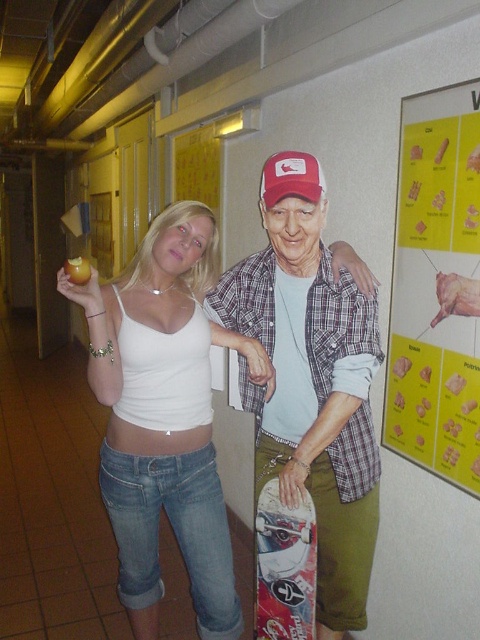
You are standing in the hallway and want to reach the point at coordinates point (x=405, y=276). If you can move forward 6 feet, will you be able to reach it?

The point (x=405, y=276) is 5.90 feet from the viewer. Since you can move forward 6 feet, you can reach it because 6 feet is more than enough to cover the 5.90 feet distance.

You are a painter who needs to hang a 18 inch wide painting between the yellow paper poster at upper right and the matte red baseball cap at upper center. Can you fit it there?

The yellow paper poster at upper right and the matte red baseball cap at upper center are 20.53 inches apart. Since the painting is 18 inches wide, it can fit between them as there is enough space.

You are a photographer trying to frame a shot of the plaid fabric shirt at center and the matte red baseball cap at upper center. Which object should you focus on first if you want to capture the wider object in your frame?

Answer: The plaid fabric shirt at center is wider than the matte red baseball cap at upper center, so you should focus on the plaid fabric shirt at center first to capture its width in the frame.